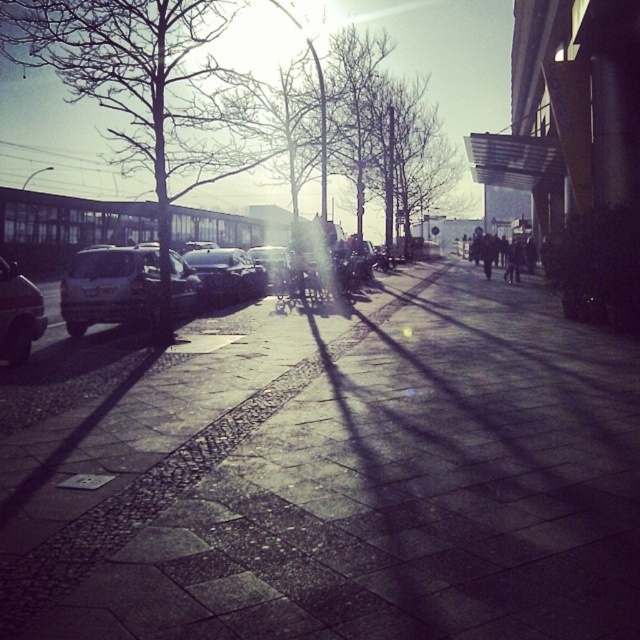
You are a delivery person who needs to park your car without blocking the sidewalk. The sidewalk is on the right side of the street. Given that the distance between the bare branches at left and the matte silver car at left is 56.13 feet, can you safely park your car between them without encroaching on the sidewalk?

The distance between the bare branches at left and the matte silver car at left is 56.13 feet. Since the sidewalk is on the right side of the street, parking between them would not interfere with the sidewalk as long as you stay within the left side parking area. However, ensure your car does not extend beyond the parking space or into the road.

You are a pedestrian walking along the street and notice the bare branches at left and the matte black car at left. Which object is closer to the left edge of the road?

The bare branches at left are closer to the left edge of the road because they are positioned on the left side of the matte black car at left.